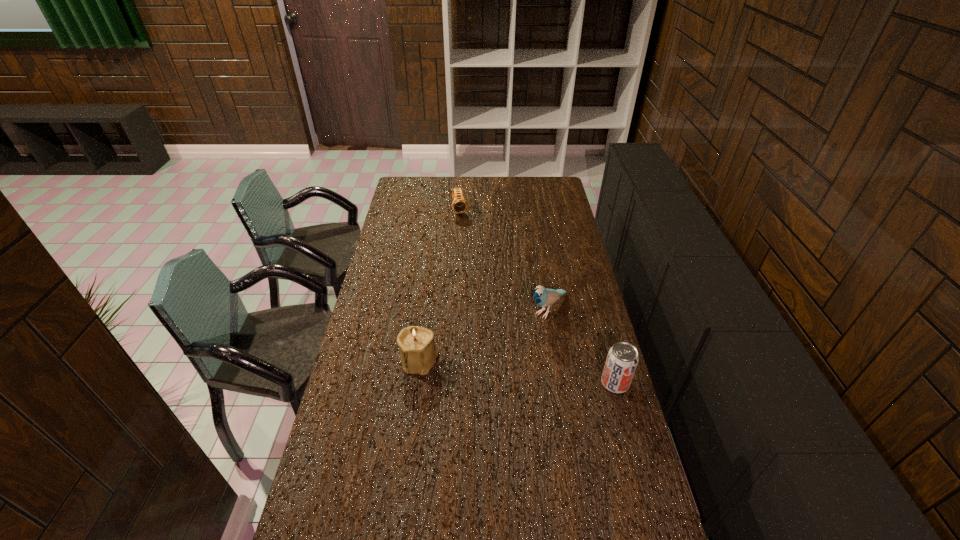
This screenshot has height=540, width=960. I want to click on vacant space at the far right corner of the desktop, so click(558, 179).

You are a GUI agent. You are given a task and a screenshot of the screen. Output one action in this format:
    pyautogui.click(x=<x>, y=<y>)
    Task: Click on the free space at the near right corner of the desktop
    The width and height of the screenshot is (960, 540).
    Given the screenshot: What is the action you would take?
    pyautogui.click(x=605, y=538)

This screenshot has width=960, height=540. Find the location of `free space between the second object from right to left and the candle_holder`. free space between the second object from right to left and the candle_holder is located at coordinates (484, 335).

At what (x,y) coordinates should I click in order to perform the action: click on free space that is in between the farthest object and the candle_holder. Please return your answer as a coordinate pair (x, y). The image size is (960, 540). Looking at the image, I should click on (440, 286).

Identify the location of empty space between the second farthest object and the soda can. tap(582, 346).

You are a GUI agent. You are given a task and a screenshot of the screen. Output one action in this format:
    pyautogui.click(x=<x>, y=<y>)
    Task: Click on the vacant space that is in between the leftmost object and the bird
    
    Given the screenshot: What is the action you would take?
    pyautogui.click(x=484, y=335)

I want to click on free spot between the bird and the farthest object, so click(504, 260).

The image size is (960, 540). I want to click on vacant space in between the watch and the second object from right to left, so click(x=504, y=260).

This screenshot has height=540, width=960. What are the coordinates of `vacant point located between the third object from left to right and the candle_holder` in the screenshot? It's located at (484, 335).

Where is `free space that is in between the candle_holder and the watch`? free space that is in between the candle_holder and the watch is located at coordinates (440, 286).